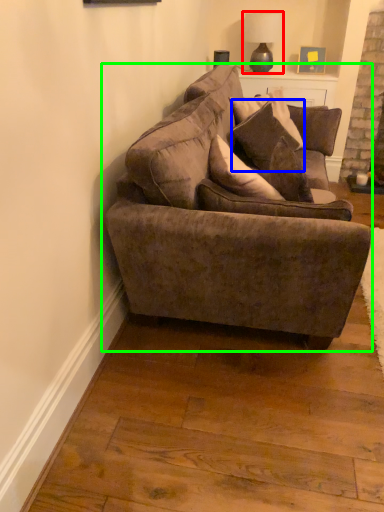
Question: Which object is the closest to the lamp (highlighted by a red box)? Choose among these: pillow (highlighted by a blue box) or studio couch (highlighted by a green box).

Choices:
 (A) pillow
 (B) studio couch

Answer: (A)